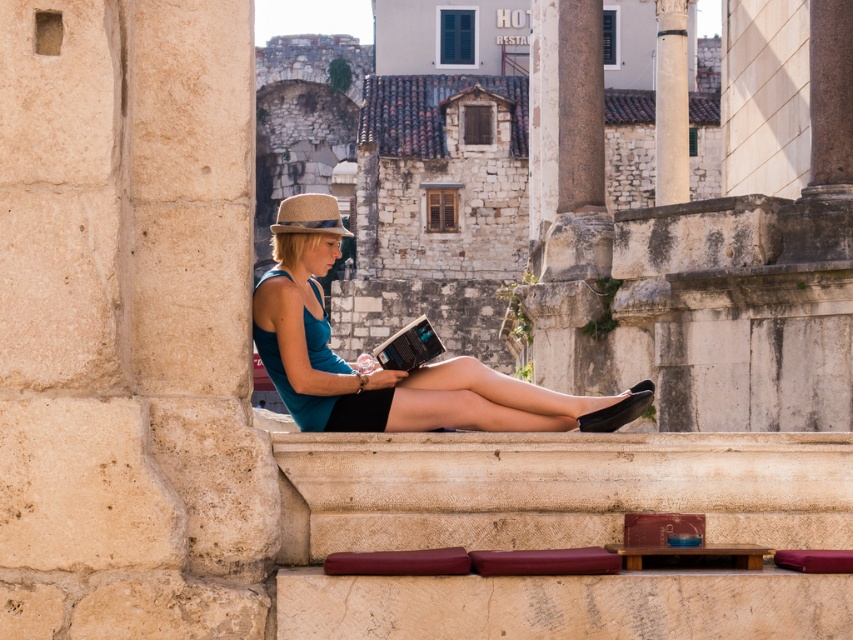
Question: Is matte blue dress at center bigger than white marble pillar at upper center?

Choices:
 (A) yes
 (B) no

Answer: (B)

Question: Considering the real-world distances, which object is farthest from the white marble pillar at upper center?

Choices:
 (A) smooth stone pillar at center
 (B) brown woven hat at center
 (C) teal fabric dress at center

Answer: (C)

Question: Is white marble pillar at upper center positioned in front of brown woven hat at center?

Choices:
 (A) yes
 (B) no

Answer: (B)

Question: Which object is the farthest from the brown woven hat at center?

Choices:
 (A) teal fabric dress at center
 (B) smooth stone pillar at center
 (C) matte blue dress at center
 (D) white marble pillar at upper center

Answer: (D)

Question: Which of these objects is positioned closest to the brown woven hat at center?

Choices:
 (A) smooth stone pillar at center
 (B) matte blue dress at center
 (C) white marble pillar at upper center
 (D) teal fabric dress at center

Answer: (B)

Question: Does matte blue dress at center appear on the right side of white marble pillar at upper center?

Choices:
 (A) yes
 (B) no

Answer: (B)